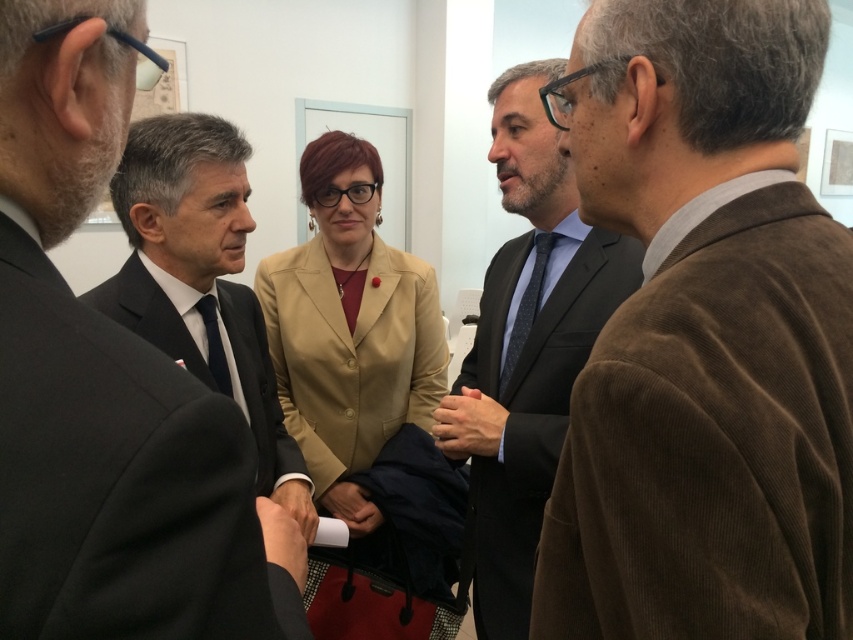
Does matte black suit at left appear over smooth skin hand at center?

Yes.

From the picture: Measure the distance from matte black suit at left to smooth skin hand at center.

matte black suit at left is 19.09 inches from smooth skin hand at center.

Find the location of a particular element. Image resolution: width=853 pixels, height=640 pixels. matte black suit at left is located at coordinates (196, 266).

Does point (824, 268) come behind point (196, 301)?

No, it is not.

Is point (566, 122) more distant than point (210, 296)?

That is False.

Find the location of a particular element. This screenshot has height=640, width=853. brown corduroy jacket at right is located at coordinates (704, 337).

How much distance is there between smooth skin hand at center and matte black tie at left?

A distance of 17.29 inches exists between smooth skin hand at center and matte black tie at left.

Is smooth skin hand at center to the right of matte black tie at left from the viewer's perspective?

Correct, you'll find smooth skin hand at center to the right of matte black tie at left.

Where is `smooth skin hand at center`? The width and height of the screenshot is (853, 640). smooth skin hand at center is located at coordinates (282, 540).